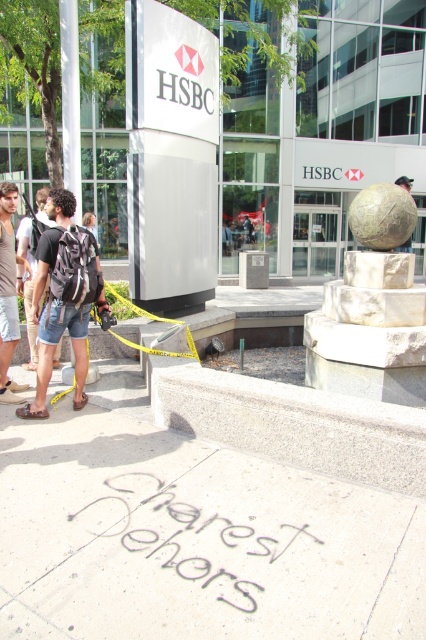
Question: Is black concrete sidewalk at lower center above black chalk writing at center?

Choices:
 (A) no
 (B) yes

Answer: (B)

Question: Does black concrete sidewalk at lower center come in front of polished bronze sphere at center?

Choices:
 (A) no
 (B) yes

Answer: (B)

Question: Can you confirm if black chalk writing at center is positioned to the left of camouflage backpack at center?

Choices:
 (A) no
 (B) yes

Answer: (A)

Question: Among these points, which one is nearest to the camera?

Choices:
 (A) (26, 253)
 (B) (131, 472)

Answer: (B)

Question: Which of the following is the farthest from the observer?

Choices:
 (A) (100, 275)
 (B) (20, 285)

Answer: (B)

Question: Which object appears closest to the camera in this image?

Choices:
 (A) black chalk writing at center
 (B) black concrete sidewalk at lower center
 (C) white plastic sign at center
 (D) polished bronze sphere at center

Answer: (B)